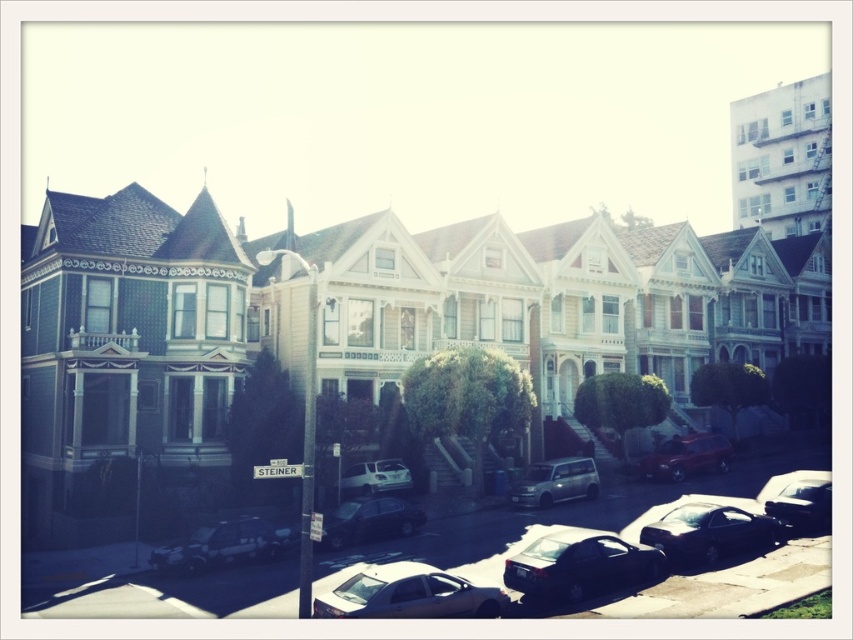
Question: In this image, where is metallic silver sedan at lower left located relative to shiny black sedan at center?

Choices:
 (A) above
 (B) below

Answer: (B)

Question: Which point is farther from the camera taking this photo?

Choices:
 (A) (810, 480)
 (B) (390, 563)
 (C) (238, 547)

Answer: (A)

Question: Is metallic silver sedan at lower left above shiny red suv at center?

Choices:
 (A) yes
 (B) no

Answer: (B)

Question: Which object appears farthest from the camera in this image?

Choices:
 (A) shiny silver sedan at lower center
 (B) satin silver van at center

Answer: (B)

Question: Is satin silver van at center closer to camera compared to white matte car at center?

Choices:
 (A) no
 (B) yes

Answer: (B)

Question: Estimate the real-world distances between objects in this image. Which object is farther from the shiny black sedan at center?

Choices:
 (A) satin silver van at center
 (B) white matte car at center
 (C) shiny red suv at center

Answer: (C)